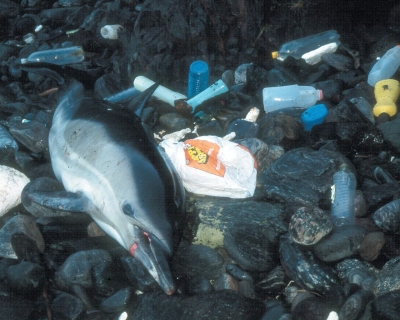
Locate an element on the screen. This screenshot has width=400, height=320. bottle is located at coordinates (353, 193).